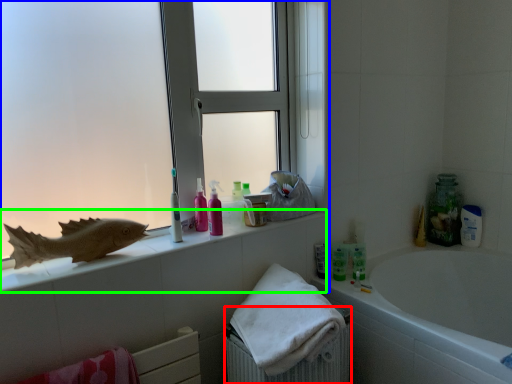
Question: Which object is positioned closest to radiator (highlighted by a red box)? Select from window (highlighted by a blue box) and counter top (highlighted by a green box).

Choices:
 (A) window
 (B) counter top

Answer: (B)